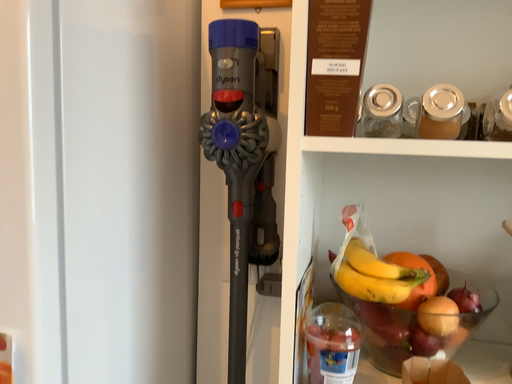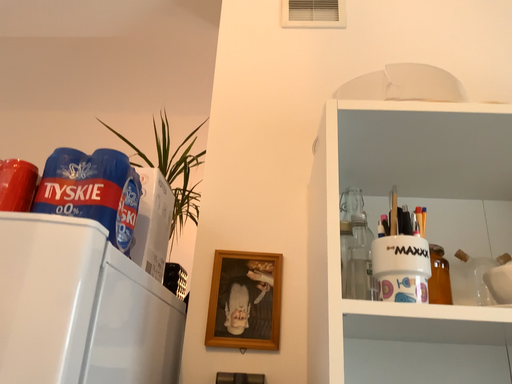
Question: How did the camera likely rotate when shooting the video?

Choices:
 (A) rotated left
 (B) rotated right

Answer: (B)